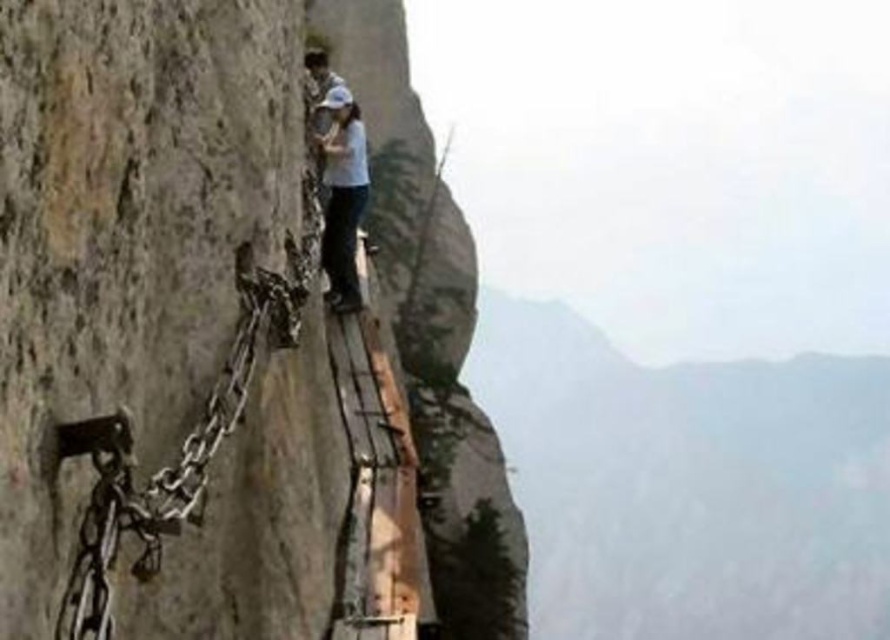
Based on the scene description, where is the point at coordinates (x=688, y=484) located?

The point at coordinates (x=688, y=484) corresponds to the rugged stone mountain at upper center.

You are a hiker planning to take the cliff path. You notice the rugged stone mountain at upper center and the white matte shirt at center. Which object is higher up the cliff?

The rugged stone mountain at upper center is taller than the white matte shirt at center, so the rugged stone mountain at upper center is higher up the cliff.